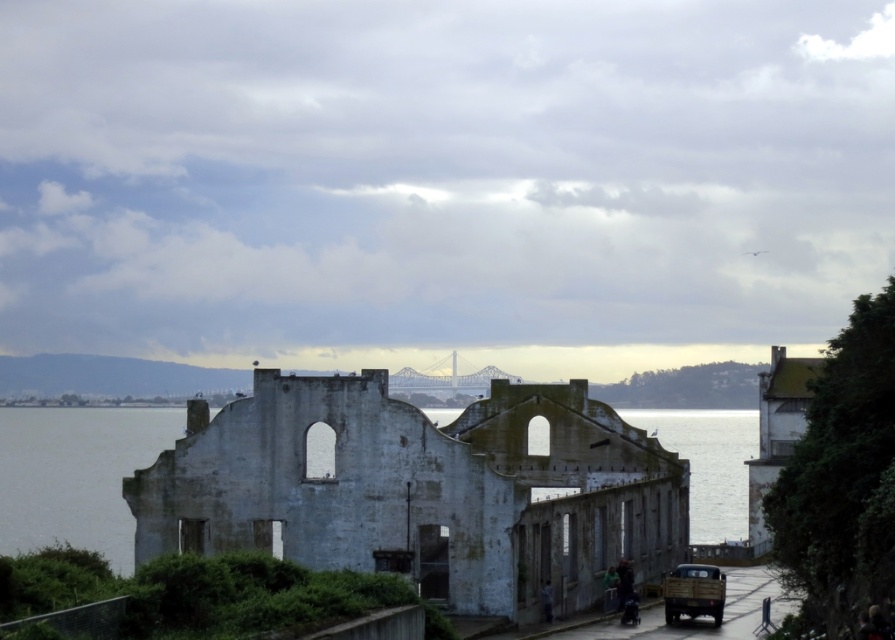
Question: Does matte brown truck at lower right come in front of dark hair at lower center?

Choices:
 (A) no
 (B) yes

Answer: (B)

Question: Does white weathered stone ruins at center appear on the right side of dark hair at lower center?

Choices:
 (A) yes
 (B) no

Answer: (B)

Question: Is dark hair at lower center to the right of green fabric jacket at lower center from the viewer's perspective?

Choices:
 (A) yes
 (B) no

Answer: (A)

Question: Which point is farther to the camera?

Choices:
 (A) white weathered stone ruins at center
 (B) dark hair at lower center
 (C) matte brown truck at lower right

Answer: (B)

Question: Which of these objects is positioned farthest from the matte brown truck at lower right?

Choices:
 (A) white weathered stone ruins at center
 (B) blue denim jeans at lower center

Answer: (A)

Question: Which object is positioned closest to the blue denim jeans at lower center?

Choices:
 (A) white weathered stone ruins at center
 (B) green fabric jacket at lower center
 (C) matte brown truck at lower right
 (D) dark hair at lower center

Answer: (D)